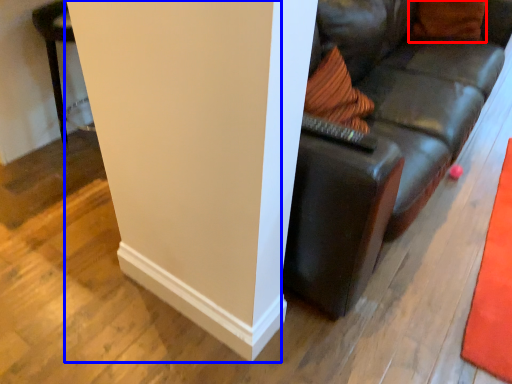
Question: Which object is closer to the camera taking this photo, pillow (highlighted by a red box) or pillar (highlighted by a blue box)?

Choices:
 (A) pillow
 (B) pillar

Answer: (B)